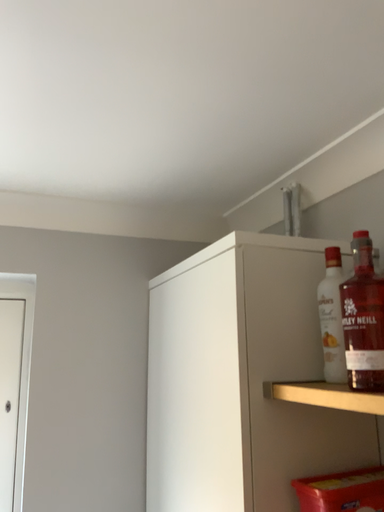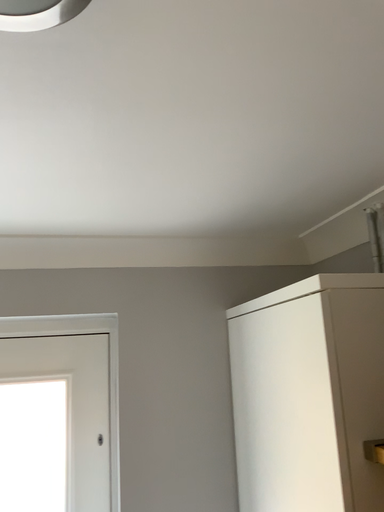
Question: Which way did the camera rotate in the video?

Choices:
 (A) rotated left
 (B) rotated right

Answer: (A)